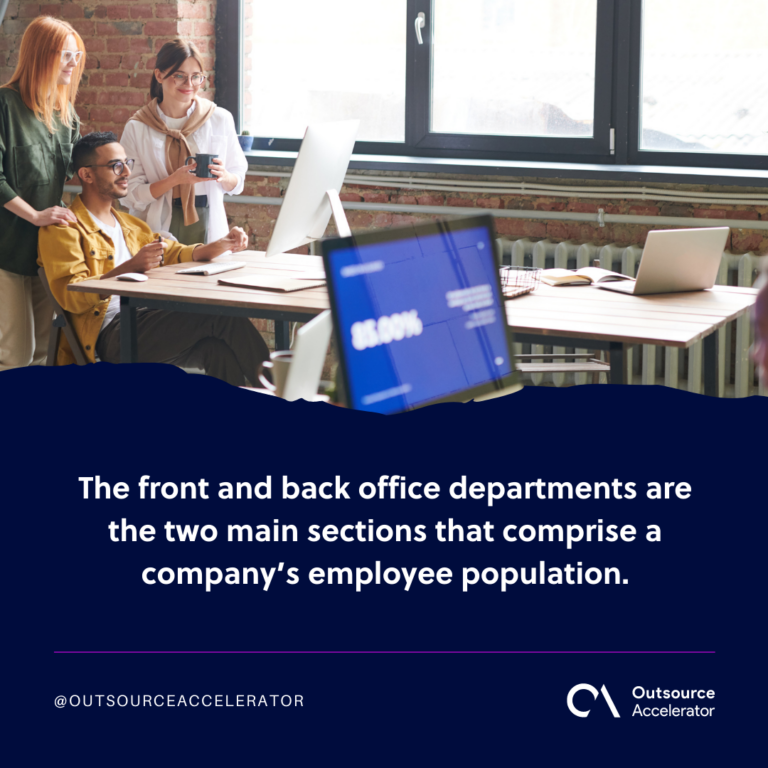
Locate an element on the screen. The image size is (768, 768). window is located at coordinates (515, 45).